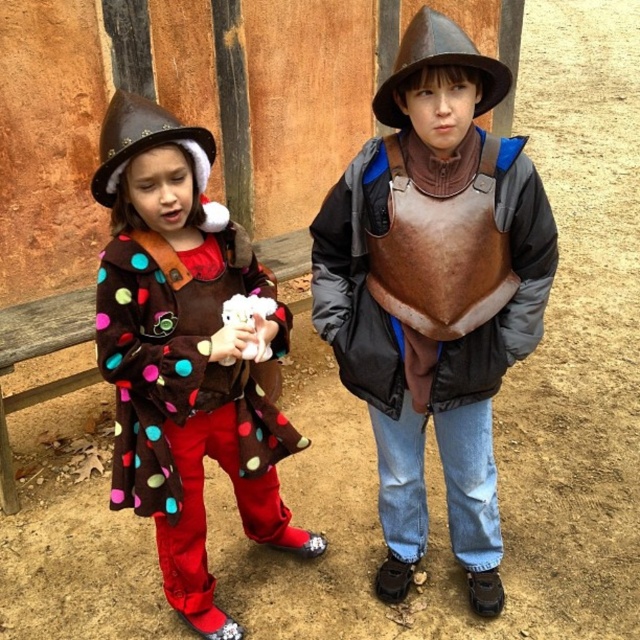
Is brown leather armor at center bigger than brown leather hat at upper center?

Yes.

Which is above, brown leather armor at center or brown leather hat at upper center?

brown leather hat at upper center

Is point (474, 332) positioned after point (384, 115)?

No, (474, 332) is in front of (384, 115).

Locate an element on the screen. The image size is (640, 640). brown leather armor at center is located at coordinates (435, 292).

Does polka dot fleece coat at center appear on the right side of brown leather hat at upper center?

In fact, polka dot fleece coat at center is to the left of brown leather hat at upper center.

Does polka dot fleece coat at center have a smaller size compared to brown leather hat at upper center?

No, polka dot fleece coat at center is not smaller than brown leather hat at upper center.

Is point (145, 240) closer to viewer compared to point (396, 109)?

That is True.

I want to click on polka dot fleece coat at center, so click(184, 353).

Can you confirm if brown felt cowboy hat at left is positioned below brown leather hat at upper center?

Yes, brown felt cowboy hat at left is below brown leather hat at upper center.

Who is shorter, brown felt cowboy hat at left or brown leather hat at upper center?

brown felt cowboy hat at left is shorter.

The height and width of the screenshot is (640, 640). I want to click on brown felt cowboy hat at left, so click(x=145, y=141).